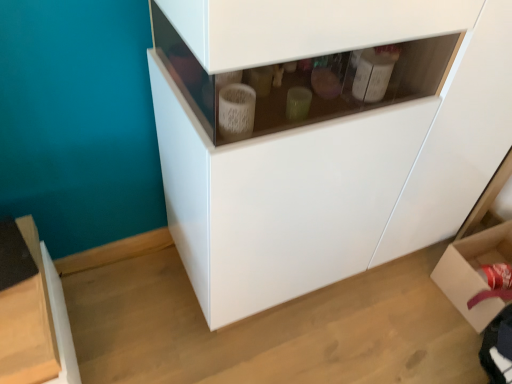
Question: Can you confirm if white glossy cabinet at center is taller than cardboard box at lower right?

Choices:
 (A) no
 (B) yes

Answer: (B)

Question: Is white glossy cabinet at center placed right next to cardboard box at lower right?

Choices:
 (A) yes
 (B) no

Answer: (B)

Question: Would you say white glossy cabinet at center contains cardboard box at lower right?

Choices:
 (A) no
 (B) yes

Answer: (A)

Question: Are white glossy cabinet at center and cardboard box at lower right far apart?

Choices:
 (A) no
 (B) yes

Answer: (A)

Question: From the image's perspective, is white glossy cabinet at center under cardboard box at lower right?

Choices:
 (A) yes
 (B) no

Answer: (B)

Question: Can you confirm if white glossy cabinet at center is wider than cardboard box at lower right?

Choices:
 (A) no
 (B) yes

Answer: (B)

Question: Is cardboard box at lower right not close to white glossy cabinet at center?

Choices:
 (A) yes
 (B) no

Answer: (B)

Question: Could you tell me if cardboard box at lower right is facing white glossy cabinet at center?

Choices:
 (A) no
 (B) yes

Answer: (A)

Question: Is cardboard box at lower right closer to camera compared to white glossy cabinet at center?

Choices:
 (A) yes
 (B) no

Answer: (B)

Question: From the image's perspective, would you say cardboard box at lower right is positioned over white glossy cabinet at center?

Choices:
 (A) no
 (B) yes

Answer: (A)

Question: Does cardboard box at lower right appear on the right side of white glossy cabinet at center?

Choices:
 (A) yes
 (B) no

Answer: (A)

Question: Can you confirm if cardboard box at lower right is taller than white glossy cabinet at center?

Choices:
 (A) no
 (B) yes

Answer: (A)

Question: From the image's perspective, is cardboard box at lower right located above or below white glossy cabinet at center?

Choices:
 (A) above
 (B) below

Answer: (B)